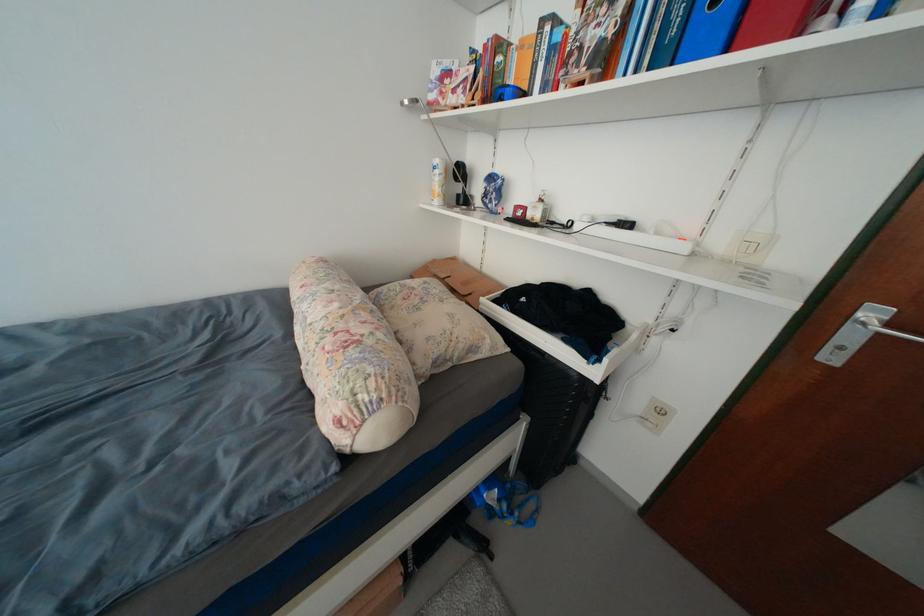
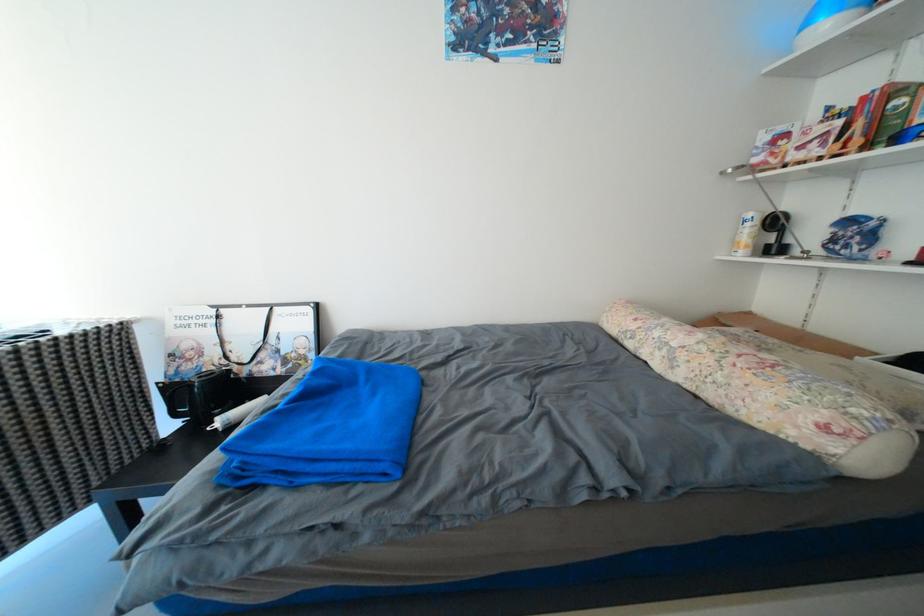
Question: The images are taken continuously from a first-person perspective. In which direction is your viewpoint rotating?

Choices:
 (A) Left
 (B) Right
 (C) Up
 (D) Down

Answer: (A)